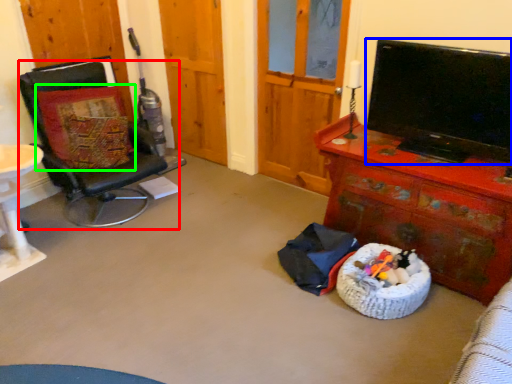
Question: Estimate the real-world distances between objects in this image. Which object is closer to chair (highlighted by a red box), television (highlighted by a blue box) or pillow (highlighted by a green box)?

Choices:
 (A) television
 (B) pillow

Answer: (B)